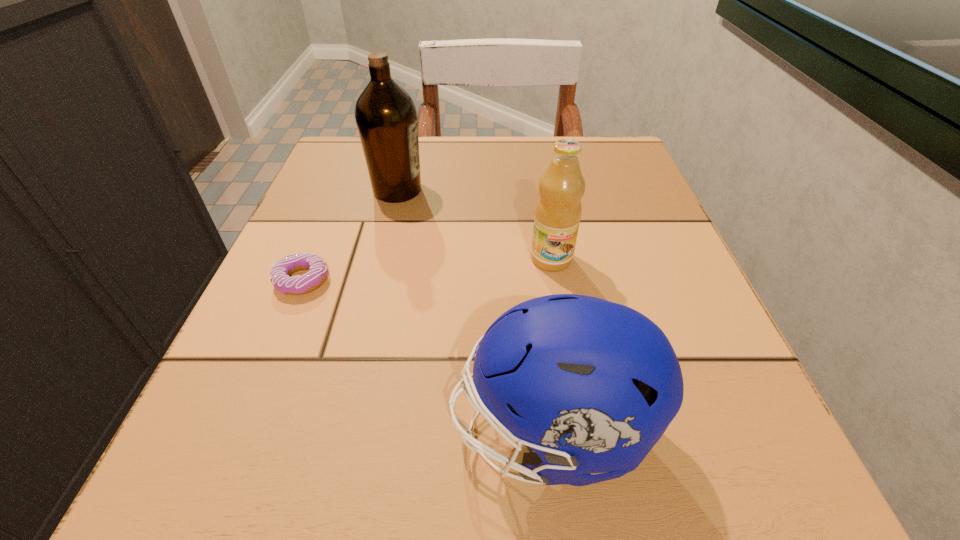
The width and height of the screenshot is (960, 540). In order to click on free space between the football helmet and the leftmost object in this screenshot , I will do `click(426, 355)`.

Find the location of a particular element. The width and height of the screenshot is (960, 540). vacant area that lies between the shortest object and the shorter olive oil is located at coordinates (427, 269).

Locate an element on the screen. Image resolution: width=960 pixels, height=540 pixels. vacant region between the football helmet and the third object from right to left is located at coordinates (473, 310).

I want to click on vacant space that is in between the farthest object and the football helmet, so click(x=473, y=310).

Image resolution: width=960 pixels, height=540 pixels. Identify the location of vacant space that's between the left olive oil and the doughnut. (350, 235).

Where is `object that stands as the second closest to the shortest object`? object that stands as the second closest to the shortest object is located at coordinates (589, 385).

I want to click on object that is the third closest to the right olive oil, so click(280, 271).

Locate an element on the screen. free space that satisfies the following two spatial constraints: 1. on the label of the right olive oil; 2. on the front-facing side of the football helmet is located at coordinates (582, 431).